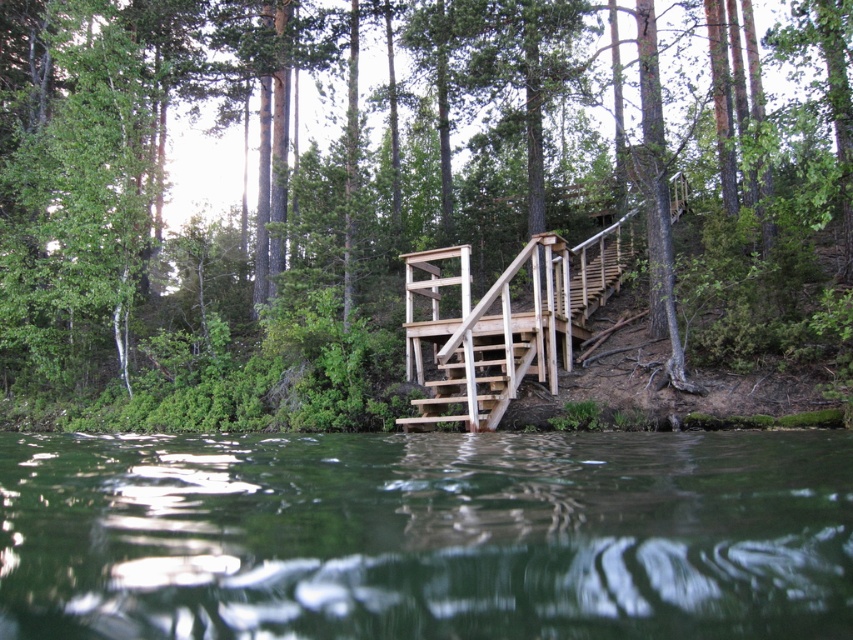
Question: Is wooden rail at center behind wooden stairs at center?

Choices:
 (A) no
 (B) yes

Answer: (A)

Question: Which point is farther to the camera?

Choices:
 (A) (538, 100)
 (B) (247, 458)

Answer: (A)

Question: Considering the real-world distances, which object is farthest from the green wood tree at upper center?

Choices:
 (A) wooden stairs at center
 (B) green liquid water at center
 (C) wooden rail at center

Answer: (B)

Question: Which object is positioned closest to the green liquid water at center?

Choices:
 (A) wooden rail at center
 (B) green wood tree at upper center
 (C) wooden stairs at center

Answer: (C)

Question: Does green wood tree at upper center have a greater width compared to wooden rail at center?

Choices:
 (A) yes
 (B) no

Answer: (A)

Question: From the image, what is the correct spatial relationship of wooden rail at center in relation to wooden stairs at center?

Choices:
 (A) above
 (B) below

Answer: (A)